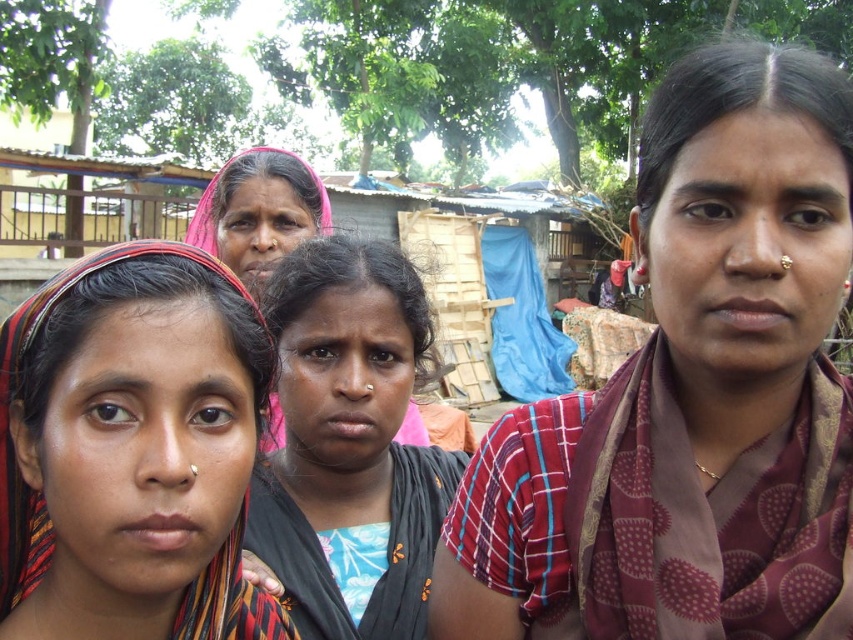
Can you confirm if maroon printed saree at center is bigger than black fabric at center?

Indeed, maroon printed saree at center has a larger size compared to black fabric at center.

Is point (728, 525) positioned after point (364, 426)?

No, (728, 525) is closer to viewer.

The height and width of the screenshot is (640, 853). Identify the location of maroon printed saree at center. (691, 396).

Where is `black fabric at center`? black fabric at center is located at coordinates (349, 444).

Can you confirm if black fabric at center is smaller than pink fabric headscarf at center?

Yes, black fabric at center is smaller than pink fabric headscarf at center.

Who is more distant from viewer, (x=294, y=428) or (x=223, y=228)?

Point (x=223, y=228)

You are a GUI agent. You are given a task and a screenshot of the screen. Output one action in this format:
    pyautogui.click(x=<x>, y=<y>)
    Task: Click on the black fabric at center
    
    Given the screenshot: What is the action you would take?
    pyautogui.click(x=349, y=444)

How much distance is there between maroon printed saree at center and pink fabric headscarf at center?

They are 1.61 meters apart.

Is maroon printed saree at center further to camera compared to pink fabric headscarf at center?

No.

Does point (682, 140) come closer to viewer compared to point (277, 429)?

Yes, point (682, 140) is closer to viewer.

At what (x,y) coordinates should I click in order to perform the action: click on maroon printed saree at center. Please return your answer as a coordinate pair (x, y). The height and width of the screenshot is (640, 853). Looking at the image, I should click on (691, 396).